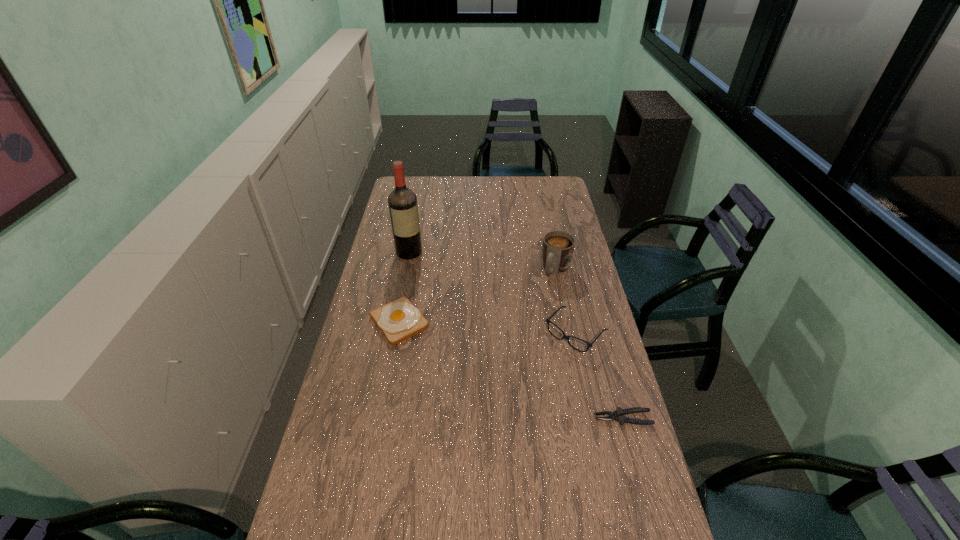
Locate an element on the screen. vacant area situated 0.180m on the side of the mug with the handle is located at coordinates (535, 310).

What are the coordinates of `vacant space situated 0.140m on the side of the mug with the handle` in the screenshot? It's located at (539, 303).

Find the location of a particular element. vacant space located on the side of the mug with the handle is located at coordinates click(519, 335).

The image size is (960, 540). Identify the location of free space located on the front-facing side of the third tallest object. (508, 404).

At what (x,y) coordinates should I click in order to perform the action: click on free point located on the front-facing side of the third tallest object. Please return your answer as a coordinate pair (x, y). The height and width of the screenshot is (540, 960). Looking at the image, I should click on (549, 361).

This screenshot has height=540, width=960. Find the location of `free space located 0.340m on the front-facing side of the third tallest object`. free space located 0.340m on the front-facing side of the third tallest object is located at coordinates (495, 418).

Locate an element on the screen. The width and height of the screenshot is (960, 540). vacant space located on the front-facing side of the tallest object is located at coordinates (440, 295).

Where is `vacant region located on the front-facing side of the tallest object`? vacant region located on the front-facing side of the tallest object is located at coordinates (427, 277).

The image size is (960, 540). I want to click on free location located 0.070m on the front-facing side of the tallest object, so click(420, 269).

The width and height of the screenshot is (960, 540). Find the location of `toast located at the left edge`. toast located at the left edge is located at coordinates (399, 320).